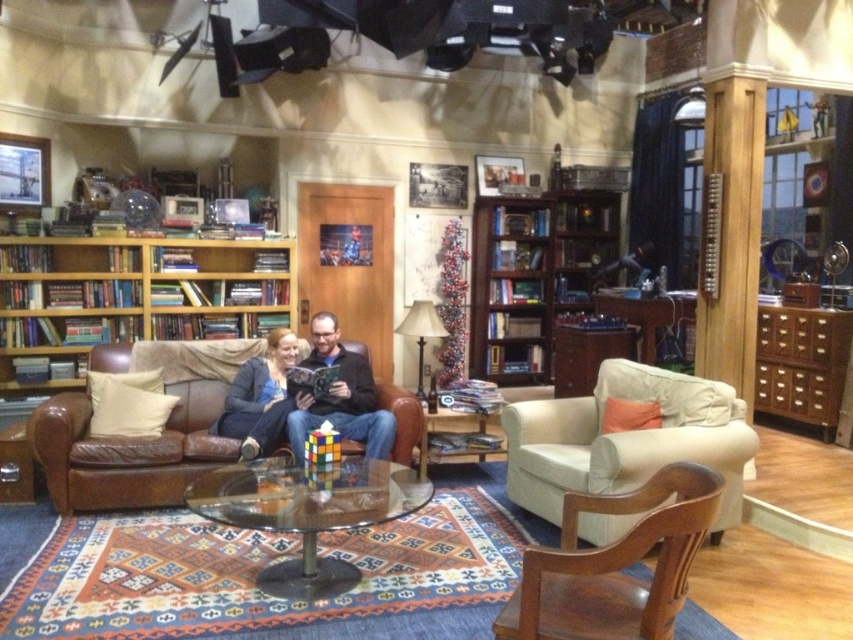
Which is in front, point (576, 611) or point (300, 408)?

Point (576, 611) is in front.

Does point (672, 474) come farther from viewer compared to point (383, 442)?

No, (672, 474) is in front of (383, 442).

Is point (682, 497) behind point (244, 417)?

No.

Find the location of a particular element. This screenshot has height=640, width=853. light brown wood armchair at lower right is located at coordinates point(614,564).

Is brown wooden bookcase at left positioned before matte black sweater at left?

No, brown wooden bookcase at left is behind matte black sweater at left.

Between brown wooden bookcase at left and matte black sweater at left, which one is positioned higher?

brown wooden bookcase at left is above.

Is point (99, 296) closer to camera compared to point (256, 392)?

No.

What are the coordinates of `brown wooden bookcase at left` in the screenshot? It's located at (131, 296).

Measure the distance between point (257, 264) and camera.

21.30 feet

Which is in front, point (30, 388) or point (102, 444)?

Point (102, 444) is more forward.

The image size is (853, 640). What are the coordinates of `brown wooden bookcase at left` in the screenshot? It's located at (131, 296).